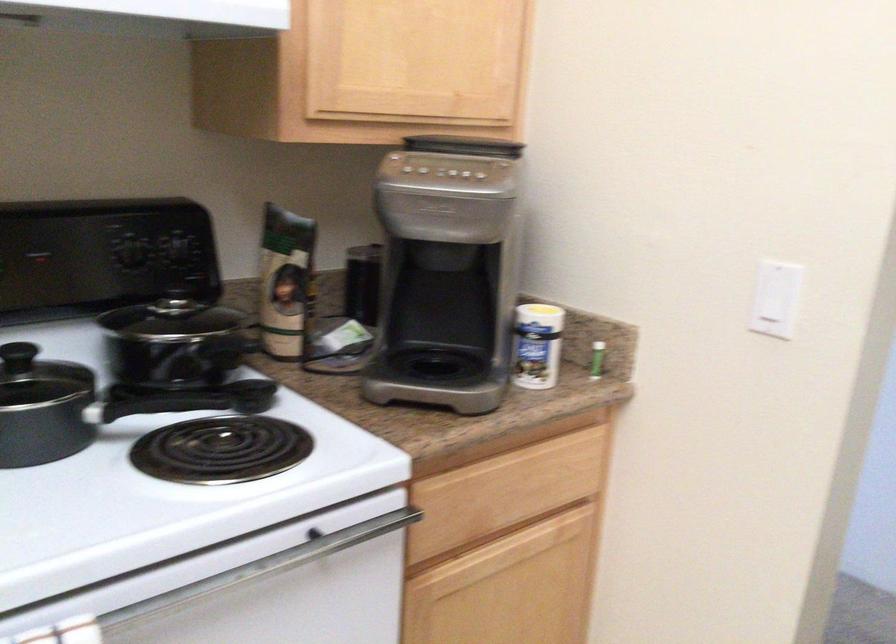
Where would you pull the lower cabinet handle? Please return your answer as a coordinate pair (x, y).

(504, 554)